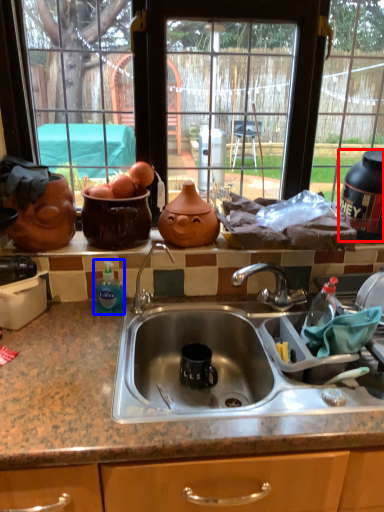
Question: Which of the following is the farthest to the observer, appliance (highlighted by a red box) or bottle (highlighted by a blue box)?

Choices:
 (A) appliance
 (B) bottle

Answer: (A)